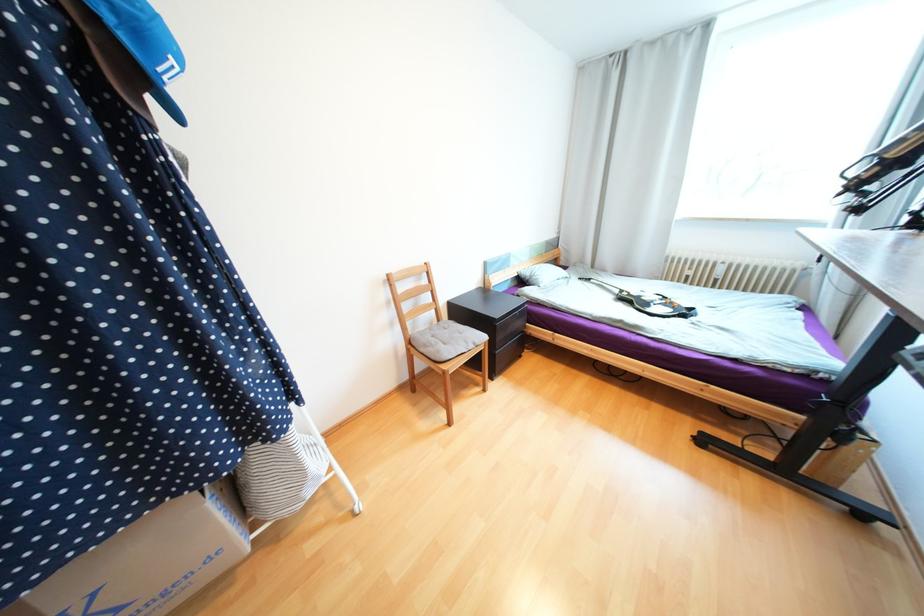
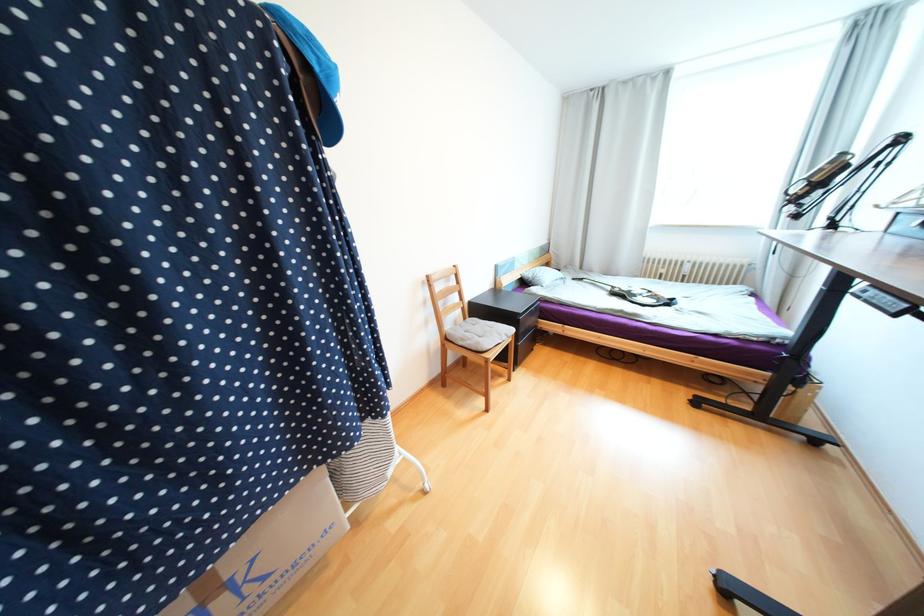
Locate, in the second image, the point that corresponds to pixel 623 292 in the first image.

(614, 288)